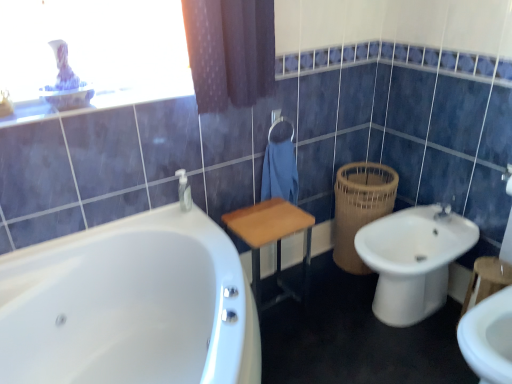
The image size is (512, 384). I want to click on vacant area situated below wooden table at center (from a real-world perspective), so click(x=278, y=304).